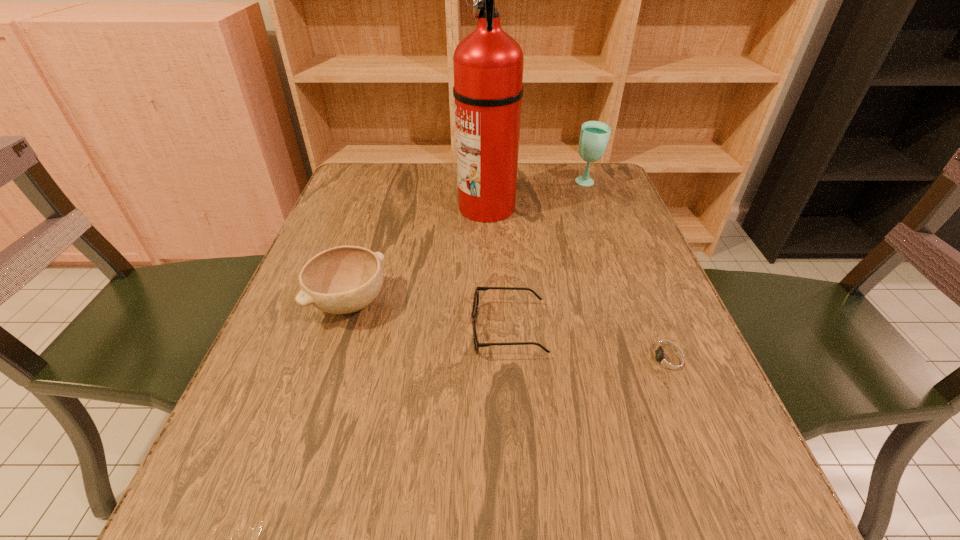
At what (x,y) coordinates should I click in order to perform the action: click on the tallest object. Please return your answer as a coordinate pair (x, y). The width and height of the screenshot is (960, 540). Looking at the image, I should click on (488, 63).

Where is `glass`? This screenshot has width=960, height=540. glass is located at coordinates (594, 136).

Where is `bowl`? This screenshot has height=540, width=960. bowl is located at coordinates (344, 279).

Where is `the third shortest object`? Image resolution: width=960 pixels, height=540 pixels. the third shortest object is located at coordinates (344, 279).

I want to click on spectacles, so click(476, 295).

This screenshot has width=960, height=540. What are the coordinates of `watch` in the screenshot? It's located at (669, 361).

You are a GUI agent. You are given a task and a screenshot of the screen. Output one action in this format:
    pyautogui.click(x=<x>, y=<y>)
    Task: Click on the free space located 0.250m at the nozzle of the tallest object
    
    Given the screenshot: What is the action you would take?
    (359, 206)

The height and width of the screenshot is (540, 960). In order to click on blank space located at the nozzle of the tallest object in this screenshot , I will do (x=367, y=206).

Find the location of `vacant space located 0.100m at the nozzle of the tallest object`. vacant space located 0.100m at the nozzle of the tallest object is located at coordinates (418, 206).

Find the location of a particular element. This screenshot has width=960, height=540. blank space located on the front of the fourth shortest object is located at coordinates (615, 260).